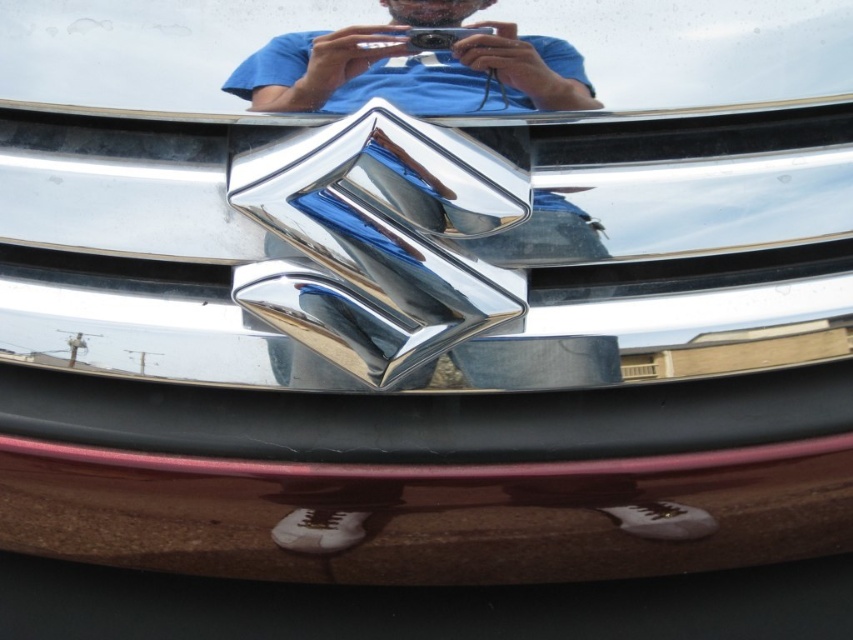
Question: Which point appears closest to the camera in this image?

Choices:
 (A) pos(352,44)
 (B) pos(389,490)

Answer: (A)

Question: Does glossy black bumper at lower center appear over chrome metallic logo at center?

Choices:
 (A) no
 (B) yes

Answer: (A)

Question: Where is glossy black bumper at lower center located in relation to chrome metallic logo at center in the image?

Choices:
 (A) below
 (B) above

Answer: (A)

Question: Among these points, which one is farthest from the camera?

Choices:
 (A) (335, 44)
 (B) (683, 540)

Answer: (B)

Question: In this image, where is glossy black bumper at lower center located relative to chrome metallic logo at center?

Choices:
 (A) left
 (B) right

Answer: (A)

Question: Which of the following is the farthest from the observer?

Choices:
 (A) glossy black bumper at lower center
 (B) chrome metallic logo at center

Answer: (A)